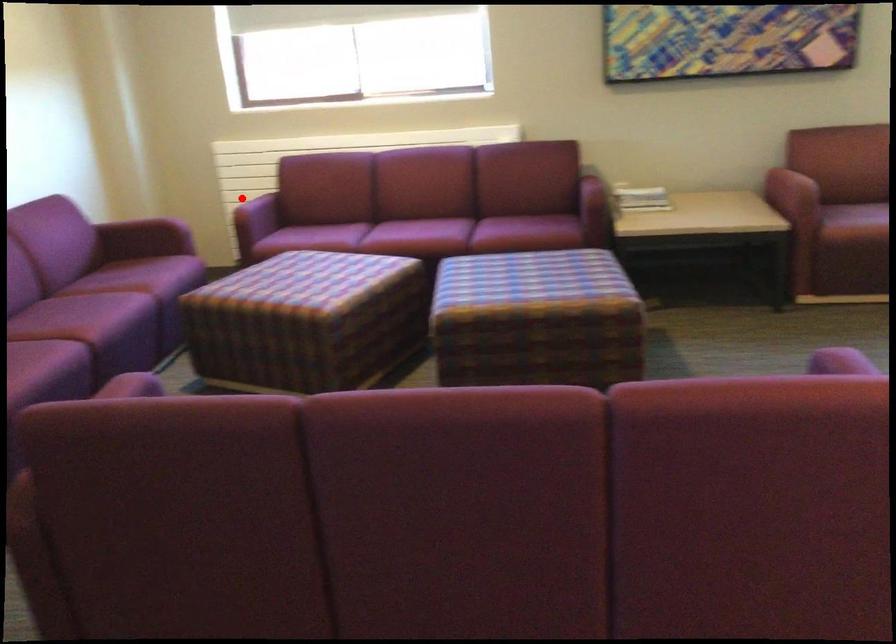
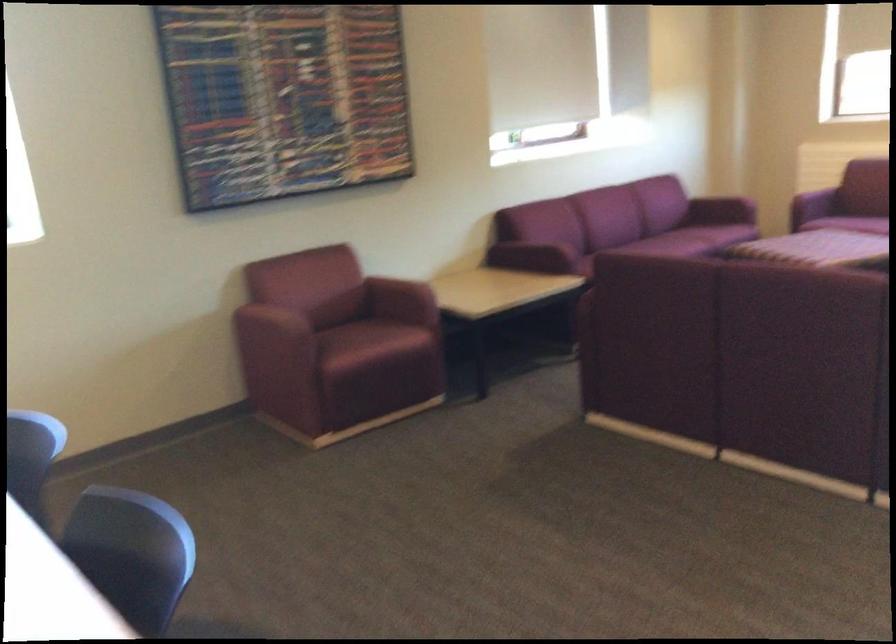
Question: I am providing you with two images of the same scene from different viewpoints. A red point is marked on the first image. Can you still see the location of the red point in image 2?

Choices:
 (A) Yes
 (B) No

Answer: (B)